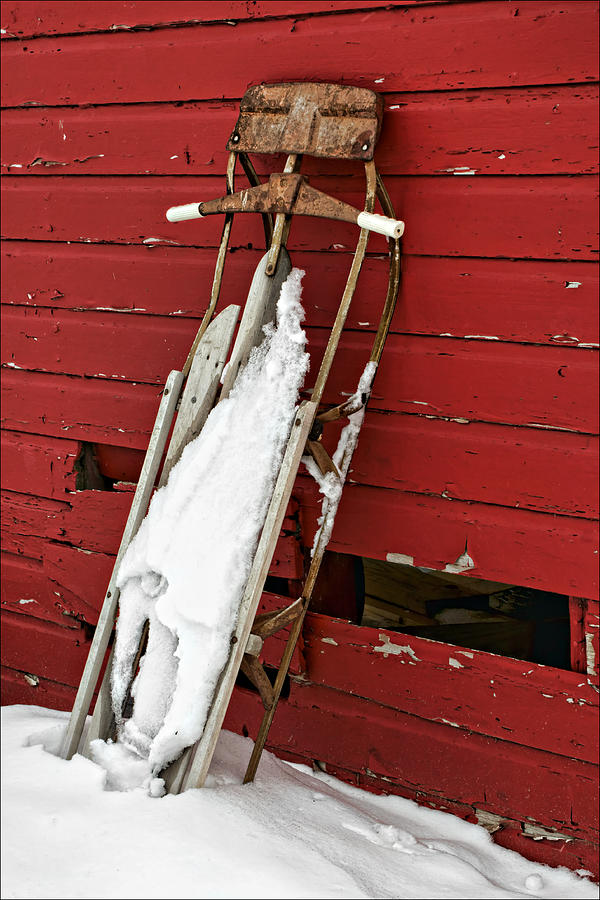
Find the location of a particular element. This screenshot has height=900, width=600. red wall is located at coordinates (466, 335).